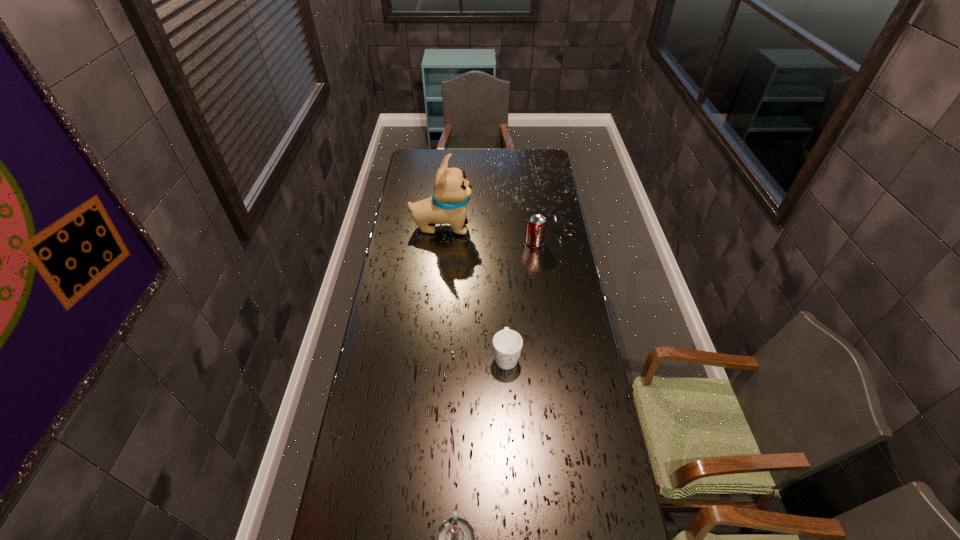
This screenshot has width=960, height=540. Identify the location of the tallest object. pos(448,205).

Locate an element on the screen. The image size is (960, 540). the rightmost object is located at coordinates (537, 225).

At what (x,y) coordinates should I click in order to perform the action: click on the second nearest object. Please return your answer as a coordinate pair (x, y). The height and width of the screenshot is (540, 960). Looking at the image, I should click on (507, 344).

At what (x,y) coordinates should I click in order to perform the action: click on the third object from left to right. Please return your answer as a coordinate pair (x, y). Image resolution: width=960 pixels, height=540 pixels. Looking at the image, I should click on (507, 344).

You are a GUI agent. You are given a task and a screenshot of the screen. Output one action in this format:
    pyautogui.click(x=<x>, y=<y>)
    Task: Click on the free point located 0.090m on the face of the tallest object
    The image size is (960, 540).
    Given the screenshot: What is the action you would take?
    pyautogui.click(x=492, y=226)

Identify the location of free location located 0.270m on the back of the rightmost object. The image size is (960, 540). (530, 202).

You are a GUI agent. You are given a task and a screenshot of the screen. Output one action in this format:
    pyautogui.click(x=<x>, y=<y>)
    Task: Click on the vacant space located on the side of the third farthest object with the handle
    The width and height of the screenshot is (960, 540).
    Given the screenshot: What is the action you would take?
    pyautogui.click(x=511, y=456)

Where is `object at the left edge`? Image resolution: width=960 pixels, height=540 pixels. object at the left edge is located at coordinates (448, 205).

I want to click on object at the right edge, so click(x=537, y=225).

This screenshot has width=960, height=540. I want to click on free space at the far edge, so click(513, 168).